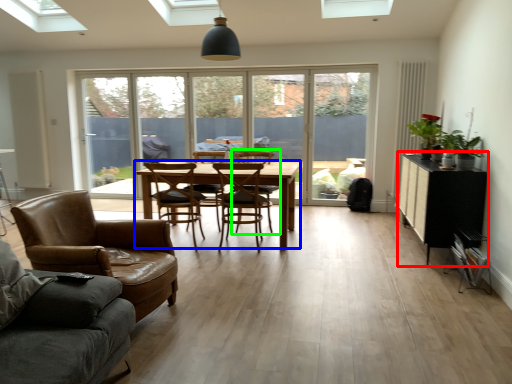
Question: Estimate the real-world distances between objects in this image. Which object is closer to table (highlighted by a red box), kitchen & dining room table (highlighted by a blue box) or armchair (highlighted by a green box)?

Choices:
 (A) kitchen & dining room table
 (B) armchair

Answer: (A)